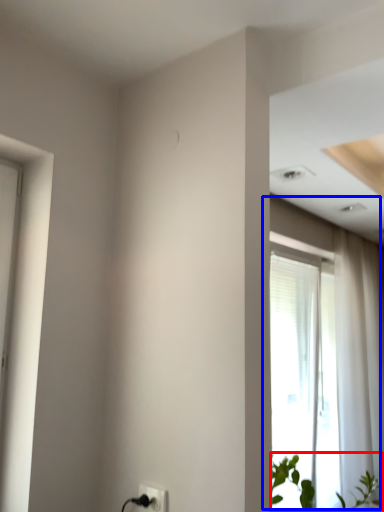
Question: Which of the following is the closest to the observer, houseplant (highlighted by a red box) or window (highlighted by a blue box)?

Choices:
 (A) houseplant
 (B) window

Answer: (A)